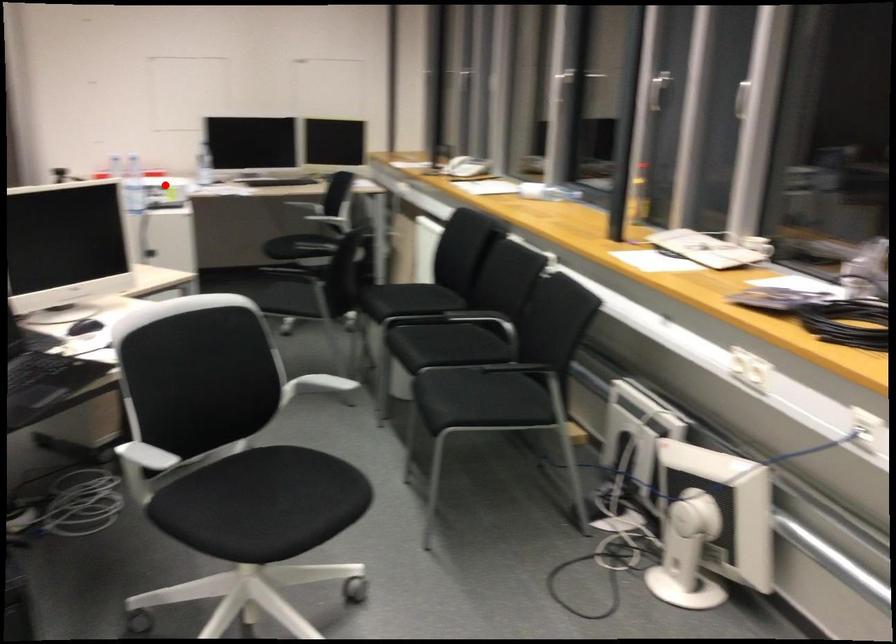
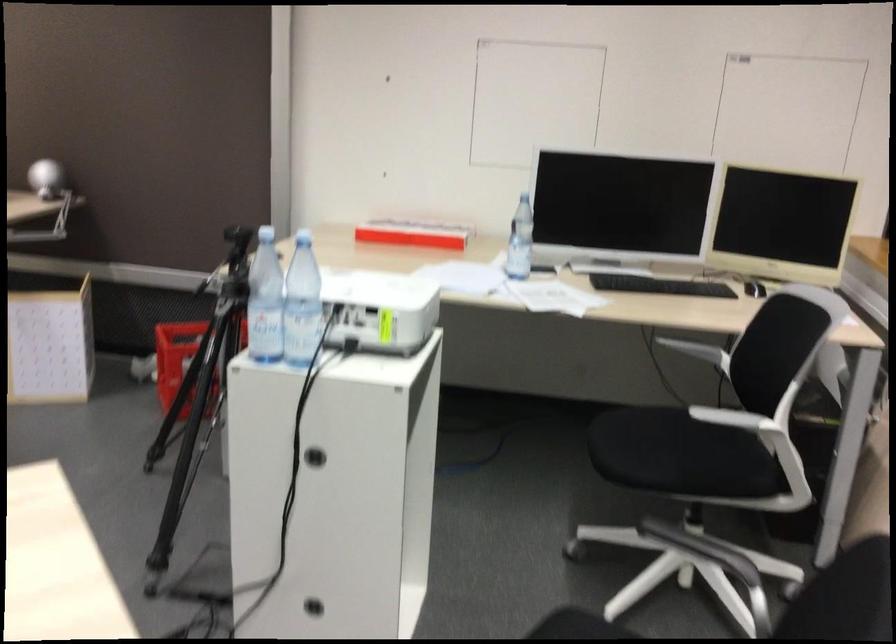
Question: I am providing you with two images of the same scene from different viewpoints. Given a red point in image1, look at the same physical point in image2. Is it:

Choices:
 (A) Closer to the viewpoint
 (B) Farther from the viewpoint

Answer: (A)